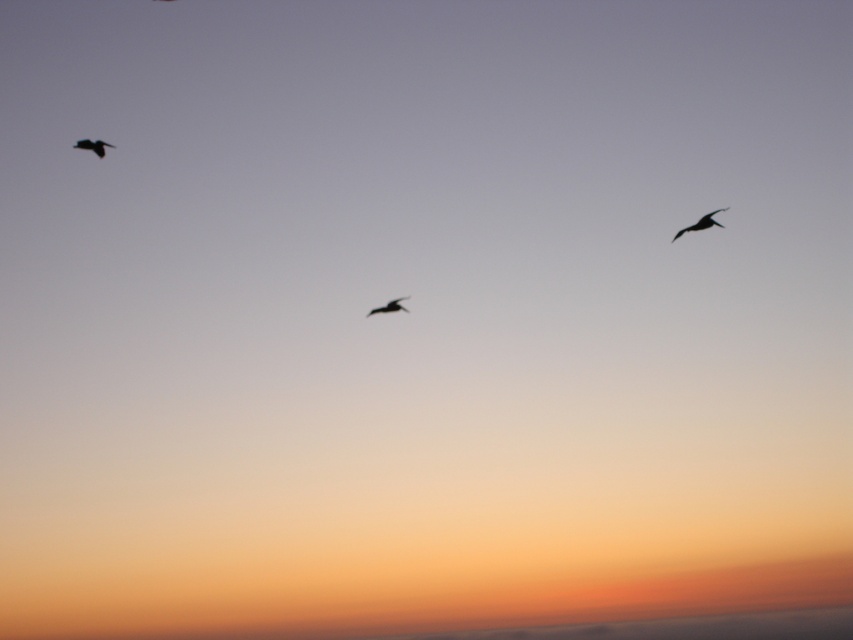
Question: Does silhouette feathered bird at upper left appear under black matte bird at center?

Choices:
 (A) no
 (B) yes

Answer: (A)

Question: Is silhouette feathered bird at upper left to the right of black matte bird at center from the viewer's perspective?

Choices:
 (A) yes
 (B) no

Answer: (B)

Question: Among these points, which one is nearest to the camera?

Choices:
 (A) (674, 236)
 (B) (90, 145)

Answer: (A)

Question: Does silhouette feathered bird at upper left appear on the left side of black matte bird at center?

Choices:
 (A) yes
 (B) no

Answer: (A)

Question: Which point appears closest to the camera in this image?

Choices:
 (A) (99, 140)
 (B) (407, 296)

Answer: (B)

Question: Which point is farther from the camera taking this photo?

Choices:
 (A) (90, 145)
 (B) (393, 308)
 (C) (700, 220)

Answer: (A)